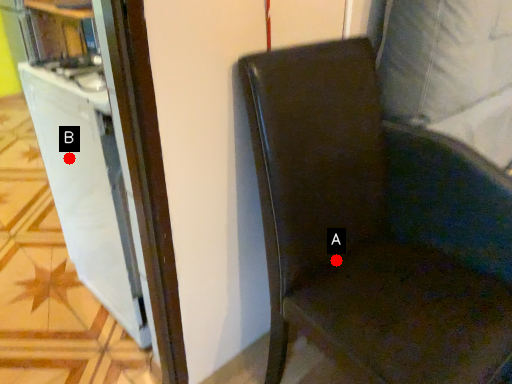
Question: Two points are circled on the image, labeled by A and B beside each circle. Among these points, which one is nearest to the camera?

Choices:
 (A) A is closer
 (B) B is closer

Answer: (A)